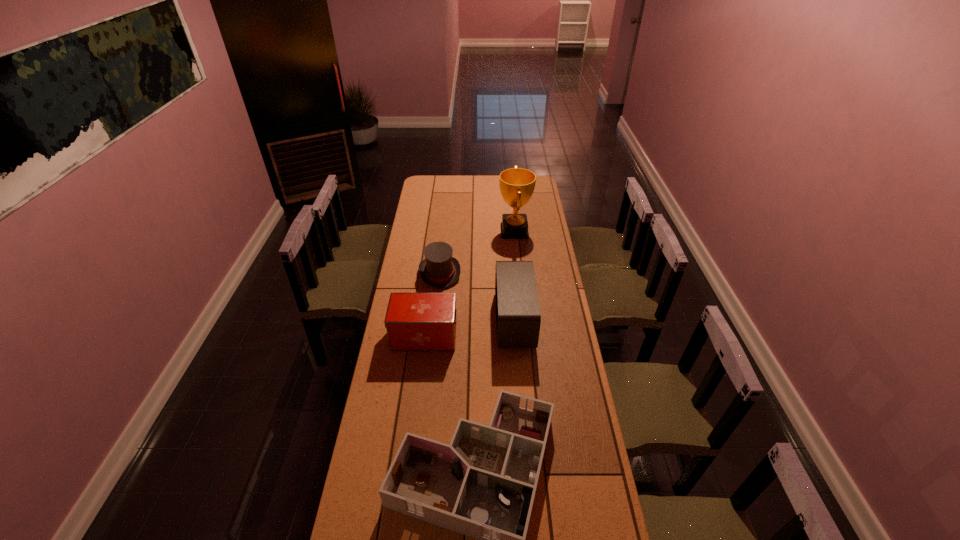
The height and width of the screenshot is (540, 960). I want to click on the tallest object, so click(x=517, y=185).

Where is `award`? award is located at coordinates (517, 185).

The width and height of the screenshot is (960, 540). I want to click on radio receiver, so click(518, 319).

Locate an element on the screen. Image resolution: width=960 pixels, height=540 pixels. the first-aid kit is located at coordinates (414, 321).

I want to click on dress hat, so click(439, 269).

You are a GUI agent. You are given a task and a screenshot of the screen. Output one action in this format:
    pyautogui.click(x=<x>, y=<y>)
    Task: Click on the second farthest object
    
    Given the screenshot: What is the action you would take?
    pyautogui.click(x=439, y=269)

Identify the location of vacant region located 0.150m on the front-facing side of the award. (471, 231).

Where is `vacant space located on the front-facing side of the award`? vacant space located on the front-facing side of the award is located at coordinates (488, 231).

Where is `vacant space situated on the front-facing side of the award`? vacant space situated on the front-facing side of the award is located at coordinates (488, 231).

Find the location of a particular element. This screenshot has height=540, width=960. vacant space located 0.140m on the front-facing side of the radio receiver is located at coordinates (465, 320).